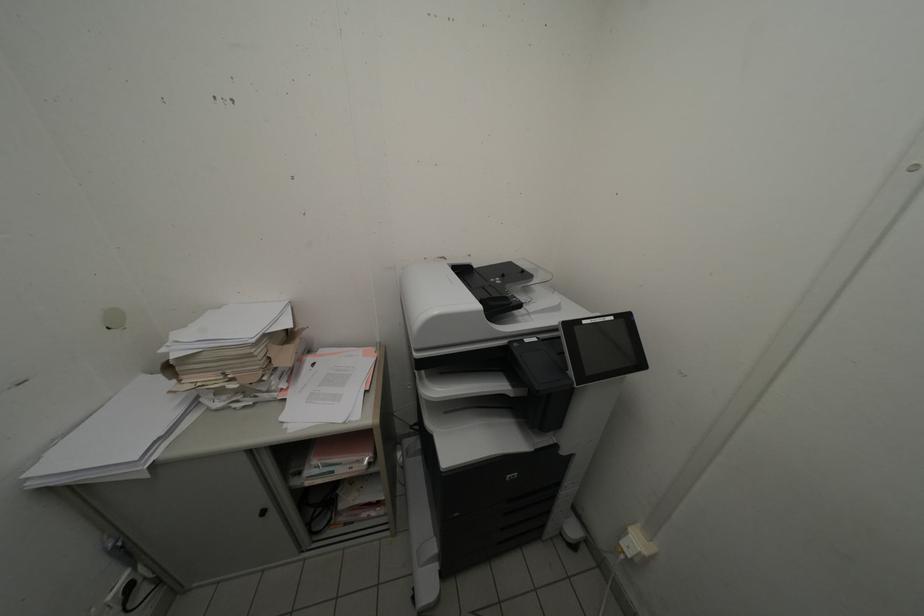
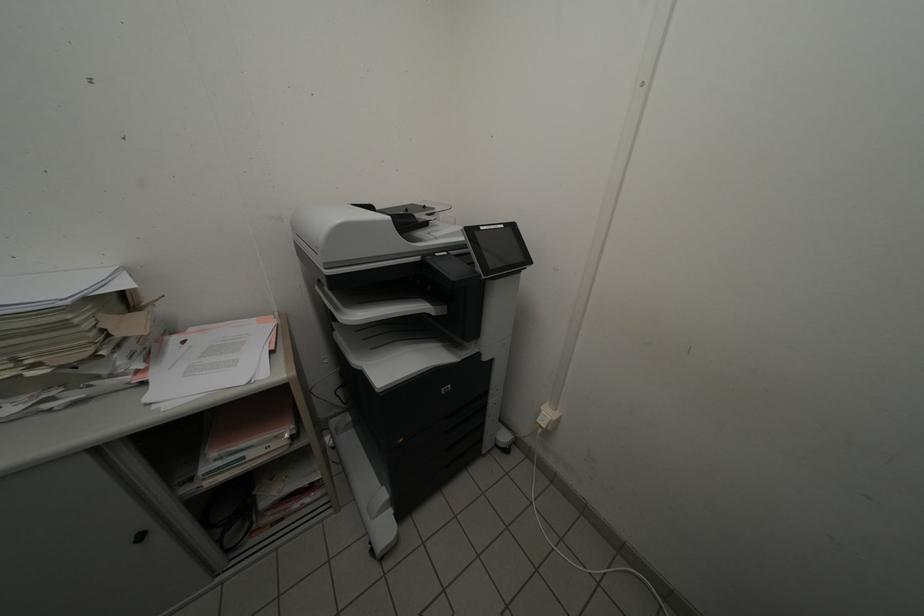
Which direction would the cameraman need to move to produce the second image?

The movement direction of the cameraman is left, backward.